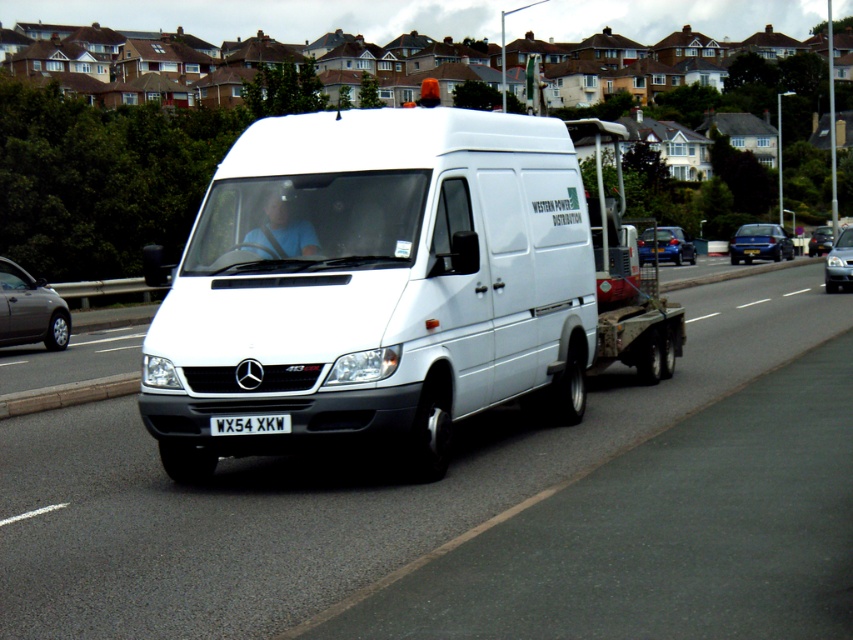
What do you see at coordinates (321, 492) in the screenshot? I see `white glossy van at center` at bounding box center [321, 492].

Between white glossy van at center and metallic blue sedan at center, which one appears on the left side from the viewer's perspective?

Positioned to the left is white glossy van at center.

Find the location of a particular element. white glossy van at center is located at coordinates (321, 492).

Identify the location of white glossy van at center. This screenshot has width=853, height=640. (321, 492).

Can you confirm if silver metallic sedan at center is positioned to the right of metallic blue sedan at center?

In fact, silver metallic sedan at center is to the left of metallic blue sedan at center.

Looking at this image, does silver metallic sedan at center have a smaller size compared to metallic blue sedan at center?

Correct, silver metallic sedan at center occupies less space than metallic blue sedan at center.

Describe the element at coordinates (839, 262) in the screenshot. Image resolution: width=853 pixels, height=640 pixels. I see `silver metallic sedan at center` at that location.

Locate an element on the screen. silver metallic sedan at center is located at coordinates (839, 262).

Can you confirm if white glossy van at center is taller than white metallic license plate at center?

Yes, white glossy van at center is taller than white metallic license plate at center.

Does white glossy van at center appear under white metallic license plate at center?

No, white glossy van at center is not below white metallic license plate at center.

What do you see at coordinates (321, 492) in the screenshot?
I see `white glossy van at center` at bounding box center [321, 492].

Where is `white glossy van at center`? The image size is (853, 640). white glossy van at center is located at coordinates (321, 492).